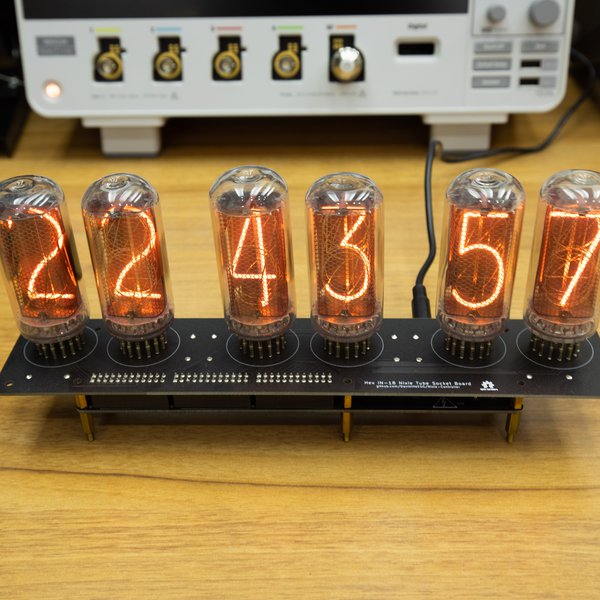
Locate an element on the screen. This screenshot has width=600, height=600. receiver is located at coordinates (415, 74).